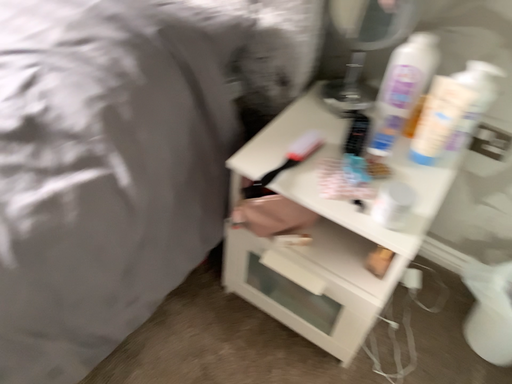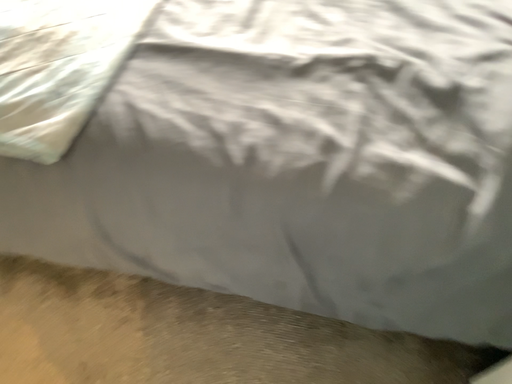
Question: How did the camera likely rotate when shooting the video?

Choices:
 (A) rotated right
 (B) rotated left

Answer: (B)